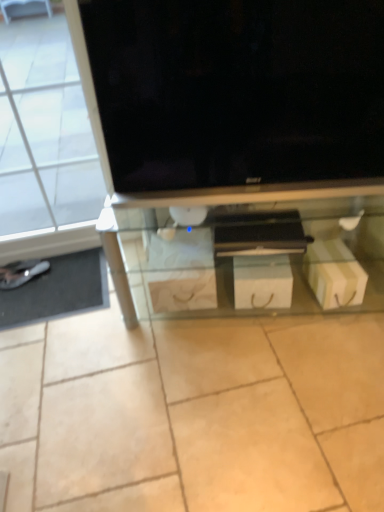
Locate an element on the screen. free point in front of shiny silver shoe at lower left is located at coordinates (24, 297).